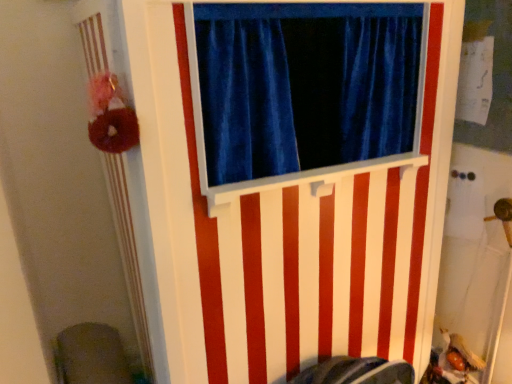
Question: Is white striped barn door at center inside the boundaries of velvet gray swivel chair at lower left, or outside?

Choices:
 (A) outside
 (B) inside

Answer: (A)

Question: Is point (382, 160) positioned closer to the camera than point (98, 359)?

Choices:
 (A) closer
 (B) farther

Answer: (A)

Question: In terms of size, does white striped barn door at center appear bigger or smaller than velvet gray swivel chair at lower left?

Choices:
 (A) big
 (B) small

Answer: (A)

Question: Looking at their shapes, would you say velvet gray swivel chair at lower left is wider or thinner than white striped barn door at center?

Choices:
 (A) thin
 (B) wide

Answer: (A)

Question: Is velvet gray swivel chair at lower left taller or shorter than white striped barn door at center?

Choices:
 (A) tall
 (B) short

Answer: (B)

Question: In the image, is velvet gray swivel chair at lower left on the left side or the right side of white striped barn door at center?

Choices:
 (A) right
 (B) left

Answer: (B)

Question: In the image, is velvet gray swivel chair at lower left positioned in front of or behind white striped barn door at center?

Choices:
 (A) front
 (B) behind

Answer: (B)